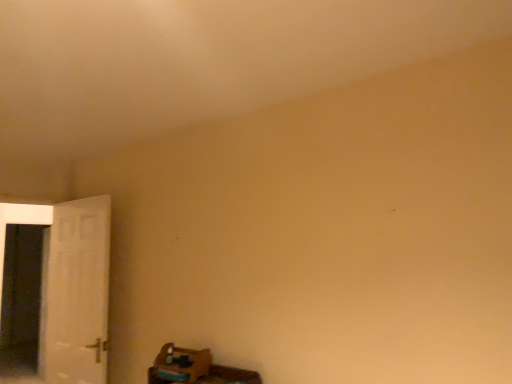
The height and width of the screenshot is (384, 512). Describe the element at coordinates (76, 294) in the screenshot. I see `white matte door at left` at that location.

What is the approximate width of white matte door at left?

It is 4.99 inches.

Where is `white matte door at left`? The height and width of the screenshot is (384, 512). white matte door at left is located at coordinates (76, 294).

Locate an element on the screen. white glossy screen door at left is located at coordinates (21, 298).

The width and height of the screenshot is (512, 384). What do you see at coordinates (21, 298) in the screenshot? I see `white glossy screen door at left` at bounding box center [21, 298].

Locate an element on the screen. white matte door at left is located at coordinates (76, 294).

Is white matte door at left to the left or to the right of white glossy screen door at left in the image?

Clearly, white matte door at left is on the right of white glossy screen door at left in the image.

Is the position of white matte door at left less distant than that of white glossy screen door at left?

Yes, white matte door at left is in front of white glossy screen door at left.

Is point (63, 222) positioned behind point (28, 350)?

No, (63, 222) is in front of (28, 350).

From the image's perspective, who appears lower, white matte door at left or white glossy screen door at left?

white glossy screen door at left.

From a real-world perspective, which is physically below, white matte door at left or white glossy screen door at left?

white glossy screen door at left, from a real-world perspective.

Considering the sizes of objects white matte door at left and white glossy screen door at left in the image provided, who is wider, white matte door at left or white glossy screen door at left?

white glossy screen door at left is wider.

Considering the sizes of objects white matte door at left and white glossy screen door at left in the image provided, who is taller, white matte door at left or white glossy screen door at left?

white glossy screen door at left is taller.

Which of these two, white matte door at left or white glossy screen door at left, is bigger?

white glossy screen door at left is bigger.

Do you think white matte door at left is within white glossy screen door at left, or outside of it?

white matte door at left is located beyond the bounds of white glossy screen door at left.

In the scene shown: Is white matte door at left positioned far away from white glossy screen door at left?

No, white matte door at left is not far away from white glossy screen door at left.

Is white glossy screen door at left at the back of white matte door at left?

No, white glossy screen door at left is not at the back of white matte door at left.

How different are the orientations of white matte door at left and white glossy screen door at left in degrees?

white matte door at left and white glossy screen door at left are facing 89.7 degrees away from each other.

At what (x,y) coordinates should I click in order to perform the action: click on door located on the right of white glossy screen door at left. Please return your answer as a coordinate pair (x, y). This screenshot has width=512, height=384. Looking at the image, I should click on (76, 294).

Is white glossy screen door at left at the left side of white matte door at left?

Indeed, white glossy screen door at left is positioned on the left side of white matte door at left.

Is white glossy screen door at left positioned before white matte door at left?

No, white glossy screen door at left is behind white matte door at left.

Does point (29, 277) come behind point (67, 227)?

Yes, point (29, 277) is farther from viewer.

From the image's perspective, does white glossy screen door at left appear lower than white matte door at left?

Indeed, from the image's perspective, white glossy screen door at left is shown beneath white matte door at left.

From a real-world perspective, is white glossy screen door at left below white matte door at left?

Yes, from a real-world perspective, white glossy screen door at left is under white matte door at left.

Looking at this image, looking at their sizes, would you say white glossy screen door at left is wider or thinner than white matte door at left?

In the image, white glossy screen door at left appears to be wider than white matte door at left.

Which of these two, white glossy screen door at left or white matte door at left, stands shorter?

Standing shorter between the two is white matte door at left.

Considering the sizes of objects white glossy screen door at left and white matte door at left in the image provided, who is bigger, white glossy screen door at left or white matte door at left?

white glossy screen door at left is bigger.

Could white matte door at left be considered to be inside white glossy screen door at left?

No, white matte door at left is located outside of white glossy screen door at left.

Is white glossy screen door at left not close to white matte door at left?

No, white glossy screen door at left is not far away from white matte door at left.

Is white glossy screen door at left positioned with its back to white matte door at left?

No.

How distant is white glossy screen door at left from white matte door at left?

A distance of 19.50 inches exists between white glossy screen door at left and white matte door at left.

Find the location of `screen door on the left of white matte door at left`. screen door on the left of white matte door at left is located at coordinates (21, 298).

Identify the location of screen door below the white matte door at left (from a real-world perspective). Image resolution: width=512 pixels, height=384 pixels. (21, 298).

Locate an element on the screen. This screenshot has height=384, width=512. door in front of the white glossy screen door at left is located at coordinates (76, 294).